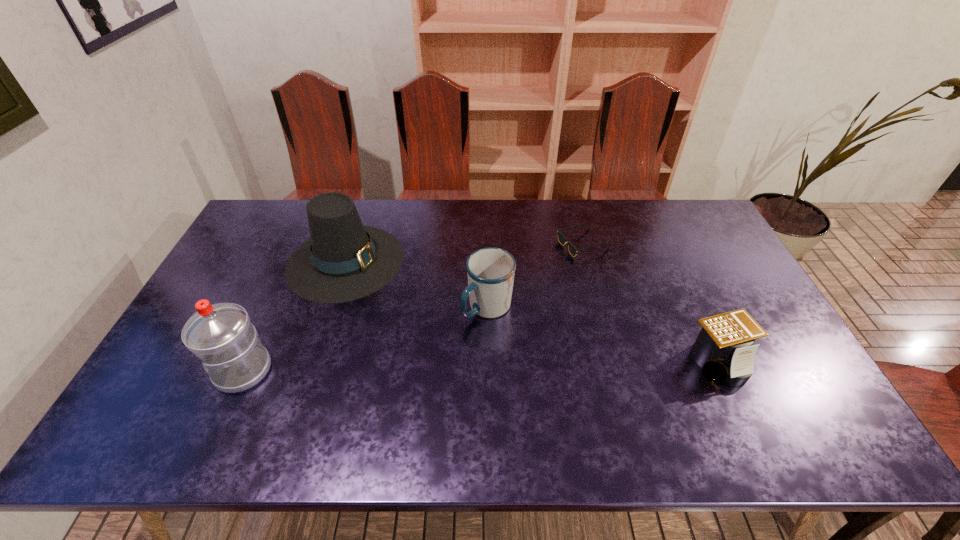
Identify the location of vacant space on the desktop that is between the water bottle and the calculator and is positioned on the lenses of the shortest object. This screenshot has width=960, height=540. (468, 366).

Locate an element on the screen. free space on the desktop that is between the water bottle and the calculator and is positioned on the handle side of the mug is located at coordinates (431, 367).

Image resolution: width=960 pixels, height=540 pixels. Find the location of `vacant spot on the desktop that is between the water bottle and the rightmost object and is positioned on the front-facing side of the hat`. vacant spot on the desktop that is between the water bottle and the rightmost object and is positioned on the front-facing side of the hat is located at coordinates (536, 365).